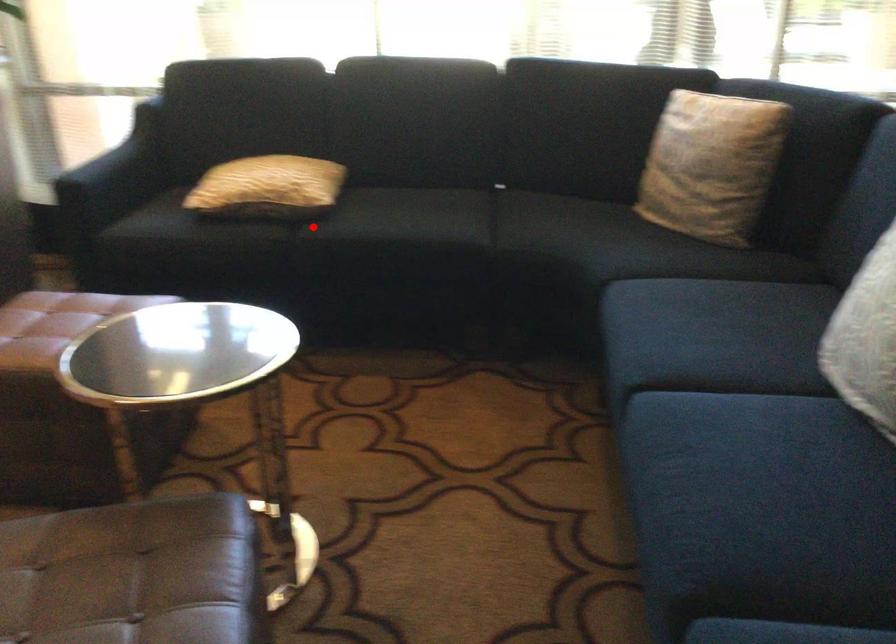
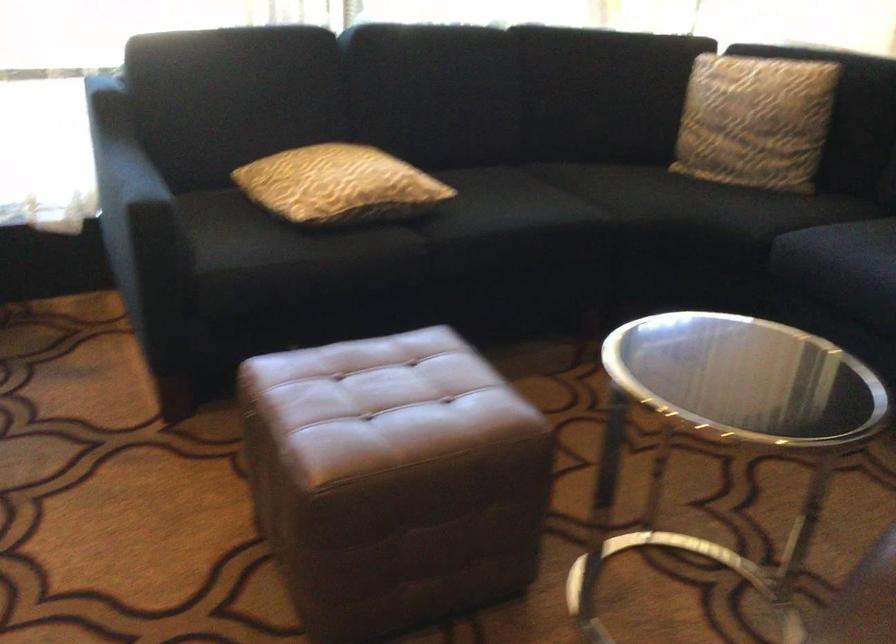
Question: I am providing you with two images of the same scene from different viewpoints. Image1 has a red point marked. In image2, the corresponding 3D location appears at what relative position? Reply with the corresponding letter.

Choices:
 (A) Closer
 (B) Farther

Answer: (A)